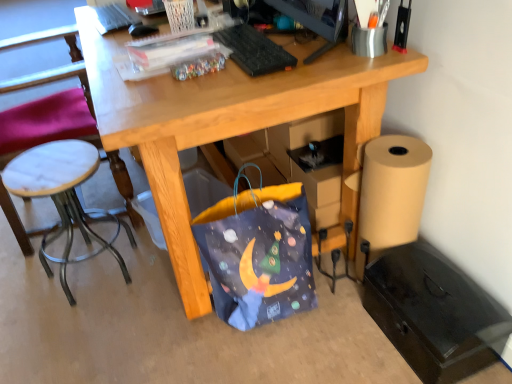
Question: Does white marble stool at left have a greater width compared to white marble stool at left?

Choices:
 (A) no
 (B) yes

Answer: (A)

Question: Is white marble stool at left next to white marble stool at left and touching it?

Choices:
 (A) yes
 (B) no

Answer: (B)

Question: Can you confirm if white marble stool at left is positioned to the right of white marble stool at left?

Choices:
 (A) yes
 (B) no

Answer: (A)

Question: Can you confirm if white marble stool at left is smaller than white marble stool at left?

Choices:
 (A) yes
 (B) no

Answer: (A)

Question: Could you tell me if white marble stool at left is facing white marble stool at left?

Choices:
 (A) no
 (B) yes

Answer: (A)

Question: Is white marble stool at left located outside white marble stool at left?

Choices:
 (A) no
 (B) yes

Answer: (B)

Question: Is white marble stool at left oriented away from white marble stool at left?

Choices:
 (A) yes
 (B) no

Answer: (B)

Question: Considering the relative sizes of white marble stool at left and white marble stool at left in the image provided, is white marble stool at left smaller than white marble stool at left?

Choices:
 (A) no
 (B) yes

Answer: (A)

Question: From the image's perspective, would you say white marble stool at left is positioned over white marble stool at left?

Choices:
 (A) yes
 (B) no

Answer: (A)

Question: Considering the relative sizes of white marble stool at left and white marble stool at left in the image provided, is white marble stool at left thinner than white marble stool at left?

Choices:
 (A) yes
 (B) no

Answer: (B)

Question: Does white marble stool at left appear on the right side of white marble stool at left?

Choices:
 (A) no
 (B) yes

Answer: (A)

Question: Does white marble stool at left have a lesser height compared to white marble stool at left?

Choices:
 (A) no
 (B) yes

Answer: (A)

Question: Would you say black plastic monitor at upper center is outside blue fabric bag at lower center?

Choices:
 (A) no
 (B) yes

Answer: (B)